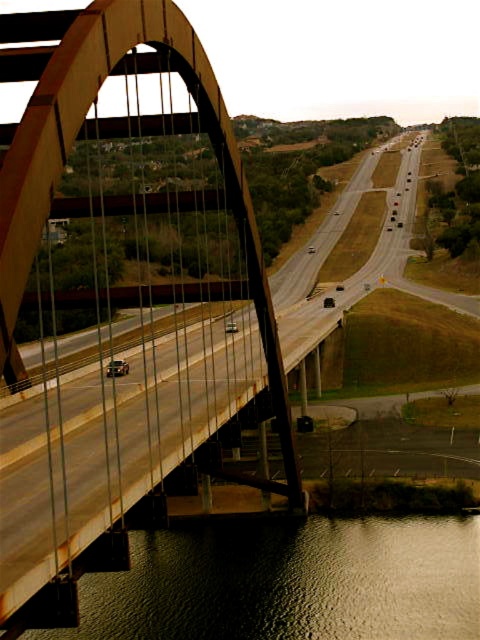
You are a pedestrian wanting to cross the river. You see the rusty metal pedestrian bridge at center and the smooth brown water at lower center. Which one should you use to safely cross the river?

The rusty metal pedestrian bridge at center is located above the smooth brown water at lower center, so you should use the rusty metal pedestrian bridge at center to safely cross the river instead of walking on the smooth brown water at lower center.

You are a delivery truck driver who needs to cross the rusty metal pedestrian bridge at center. The truck is 3 meters wide. Can you safely pass through the bridge? Please refer to the smooth brown water at lower center for comparison.

The rusty metal pedestrian bridge at center is wider than the smooth brown water at lower center. Since the truck is 3 meters wide, and the bridge is wider than the water, but the exact width of the bridge isn not provided, it is impossible to determine if the truck can safely pass through based on the given information.

You are a pedestrian trying to cross the river. You see the rusty metal pedestrian bridge at center and the smooth brown water at lower center. Which one is closer to you?

The rusty metal pedestrian bridge at center is closer because it is in front of the smooth brown water at lower center.